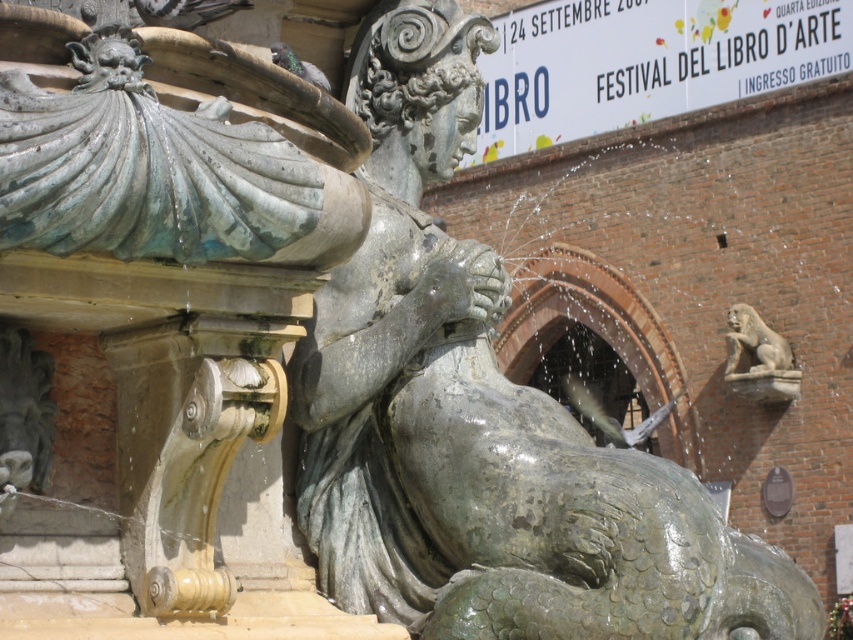
You are a photographer trying to capture the bronze statue in the center. You notice a gray stone lion at upper right and a gray matte pigeon at upper left. Which object should you avoid including in your shot if you want to focus on the statue and avoid distractions caused by larger objects?

The gray stone lion at upper right is larger in size compared to the gray matte pigeon at upper left, so you should avoid including the gray stone lion at upper right in your shot to minimize distractions.

You are a photographer standing at the base of the fountain. You want to capture both the gray stone lion at upper right and the gray feathered pigeon at upper left in a single wide shot. Given the distance between them, will your camera with a 35mm lens be able to include both subjects in the frame?

The distance between the gray stone lion at upper right and the gray feathered pigeon at upper left is 54.83 meters. A 35mm lens has a wide field of view, so it should be capable of capturing both subjects in a single frame from the photographer standing at the base of the fountain.